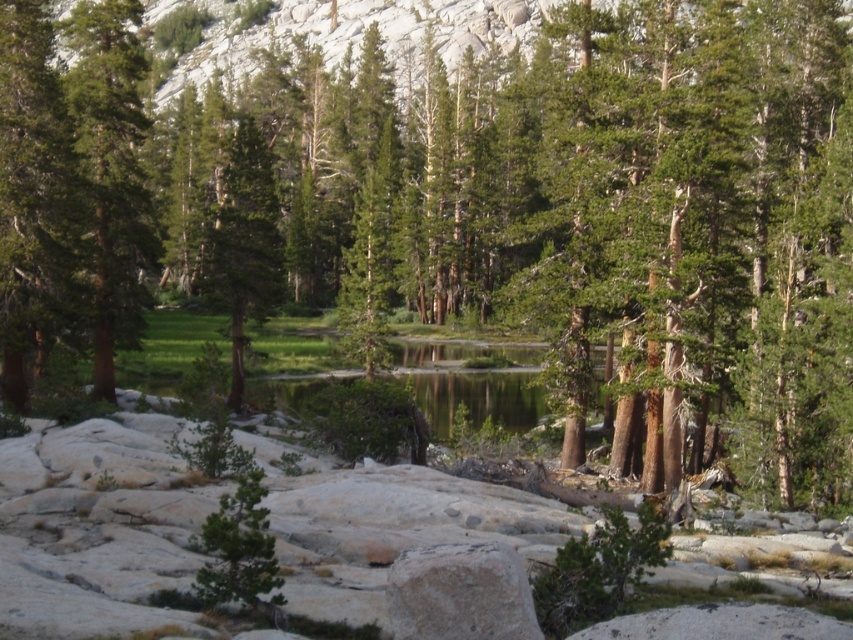
Question: Is green matte tree at left above green matte tree at center?

Choices:
 (A) no
 (B) yes

Answer: (A)

Question: Is green matte tree at left bigger than green matte tree at center?

Choices:
 (A) yes
 (B) no

Answer: (B)

Question: Which object appears closest to the camera in this image?

Choices:
 (A) green matte tree at center
 (B) green matte tree at left

Answer: (B)

Question: Is green matte tree at left wider than green matte tree at center?

Choices:
 (A) yes
 (B) no

Answer: (B)

Question: Which of the following is the farthest from the observer?

Choices:
 (A) (140, 321)
 (B) (207, 298)

Answer: (A)